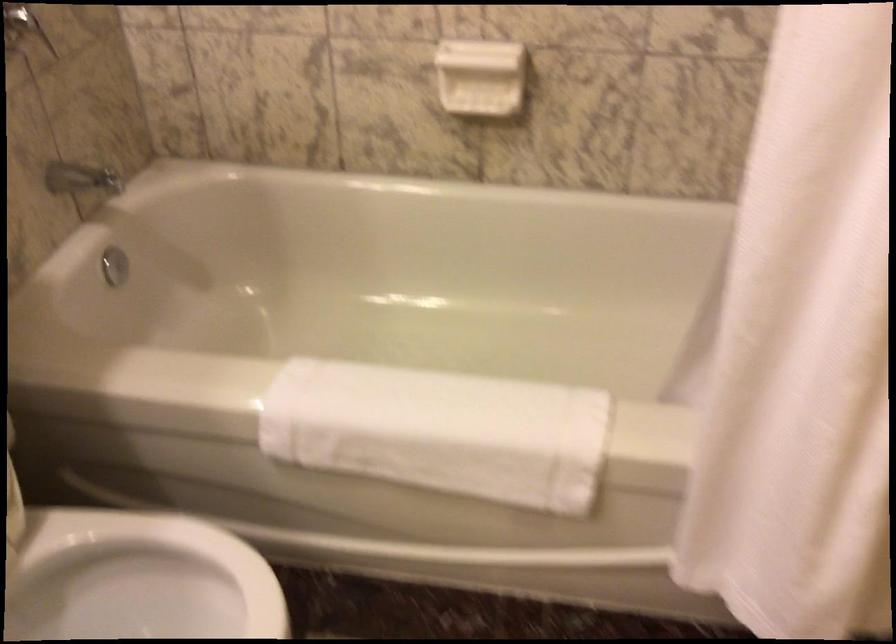
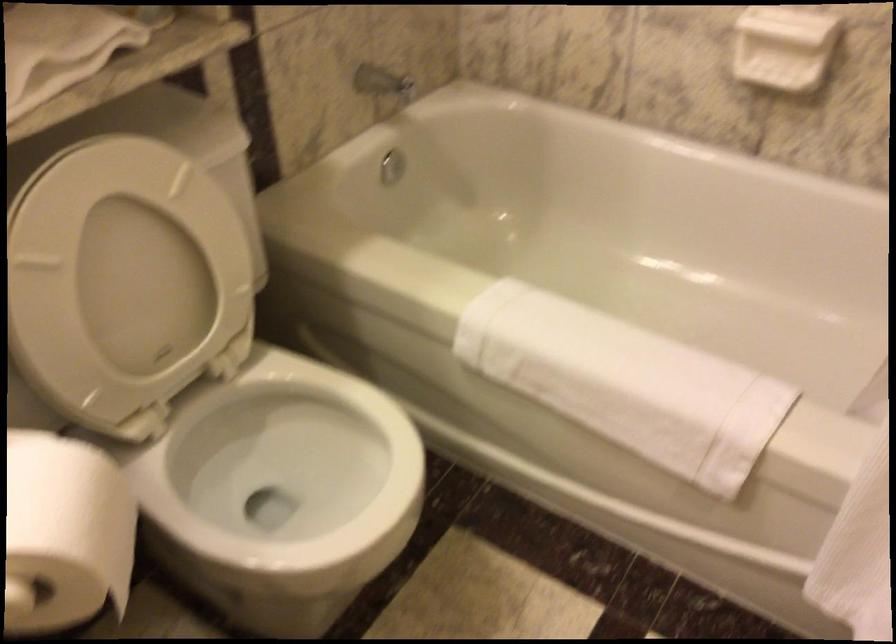
Find the pixel in the second image that matches the point at 483,76 in the first image.

(782, 46)